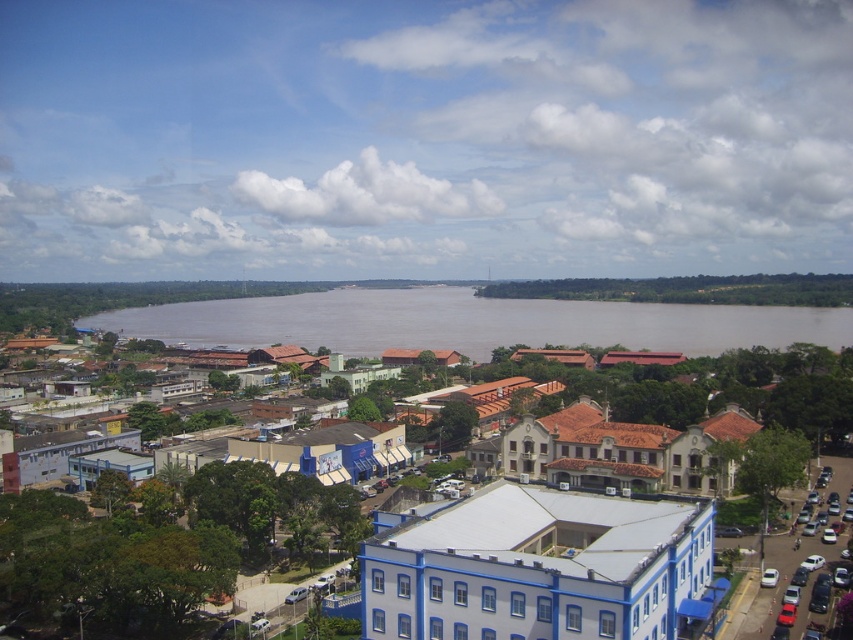
Question: Can you confirm if white matte building at center is positioned to the left of brown muddy water at center?

Choices:
 (A) yes
 (B) no

Answer: (B)

Question: Which of the following is the farthest from the observer?

Choices:
 (A) (631, 324)
 (B) (660, 488)

Answer: (A)

Question: Does white matte building at center appear under brown muddy water at center?

Choices:
 (A) yes
 (B) no

Answer: (A)

Question: Can you confirm if white matte building at center is smaller than brown muddy water at center?

Choices:
 (A) yes
 (B) no

Answer: (A)

Question: Which object is farther from the camera taking this photo?

Choices:
 (A) white matte building at center
 (B) brown muddy water at center

Answer: (B)